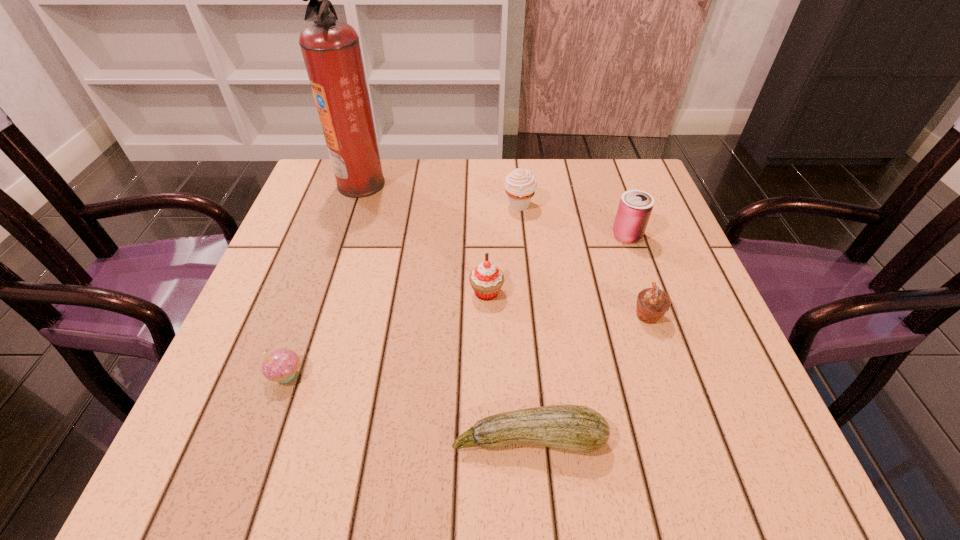
Identify the location of zucchini. The width and height of the screenshot is (960, 540). (576, 428).

Find the location of `vacant region located at the nozzle of the tallest object`. vacant region located at the nozzle of the tallest object is located at coordinates (485, 184).

The height and width of the screenshot is (540, 960). Find the location of `vacant space situated 0.080m on the right of the farther muffin`. vacant space situated 0.080m on the right of the farther muffin is located at coordinates (568, 206).

Locate an element on the screen. vacant space located on the left of the can is located at coordinates (501, 235).

Find the location of a particular element. blank area located on the front of the right cupcake is located at coordinates (489, 448).

Where is `free location located 0.350m on the back of the nearer muffin`? This screenshot has height=540, width=960. free location located 0.350m on the back of the nearer muffin is located at coordinates (608, 198).

The height and width of the screenshot is (540, 960). I want to click on free space located 0.110m on the right of the nearer cupcake, so click(x=369, y=375).

Where is `fire extinguisher that is at the far edge`? The image size is (960, 540). fire extinguisher that is at the far edge is located at coordinates (331, 50).

The image size is (960, 540). What are the coordinates of `muffin that is at the far edge` in the screenshot? It's located at (520, 184).

The height and width of the screenshot is (540, 960). Identify the location of object situated at the near edge. (576, 428).